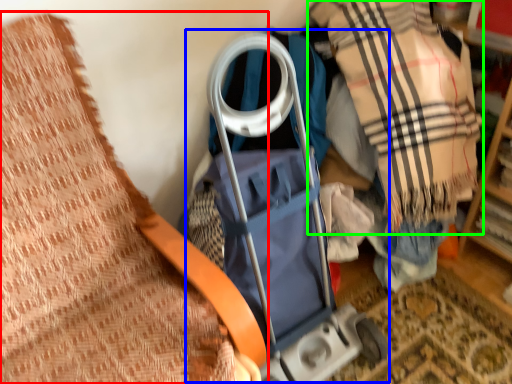
Question: Considering the real-world distances, which object is farthest from furniture (highlighted by a red box)? baby carriage (highlighted by a blue box) or plaid (highlighted by a green box)?

Choices:
 (A) baby carriage
 (B) plaid

Answer: (B)